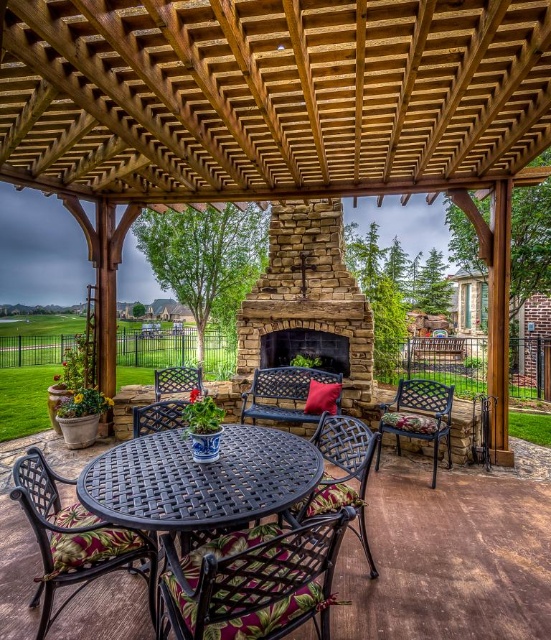
Image resolution: width=551 pixels, height=640 pixels. What do you see at coordinates (253, 580) in the screenshot? I see `floral-patterned fabric chair at center` at bounding box center [253, 580].

Who is taller, floral-patterned fabric chair at center or metallic woven chair at center?

Standing taller between the two is metallic woven chair at center.

Is point (310, 598) less distant than point (322, 436)?

Yes, it is.

Where is `floral-patterned fabric chair at center`? Image resolution: width=551 pixels, height=640 pixels. floral-patterned fabric chair at center is located at coordinates (253, 580).

Does black woven table at center have a lesser width compared to black stone fireplace at center?

In fact, black woven table at center might be wider than black stone fireplace at center.

Who is more distant from viewer, (112, 499) or (332, 344)?

The point (332, 344) is more distant.

Where is `black woven table at center`? black woven table at center is located at coordinates (199, 481).

Does natural stone fireplace at center appear over floral-patterned fabric chair at center?

Indeed, natural stone fireplace at center is positioned over floral-patterned fabric chair at center.

Is natural stone fireplace at center taller than floral-patterned fabric chair at center?

Correct, natural stone fireplace at center is much taller as floral-patterned fabric chair at center.

Is point (267, 353) positioned behind point (245, 621)?

Yes.

You are a GUI agent. You are given a task and a screenshot of the screen. Output one action in this format:
    pyautogui.click(x=<x>, y=<y>)
    Task: Click on the natural stone fireplace at center
    
    Given the screenshot: What is the action you would take?
    pyautogui.click(x=309, y=305)